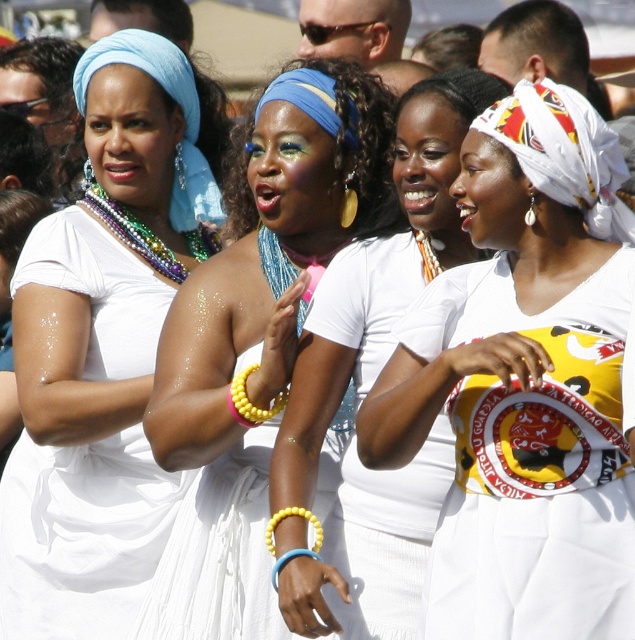
Question: Which of the following is the closest to the observer?

Choices:
 (A) (321, 97)
 (B) (239, 371)

Answer: (A)

Question: Does matte blue headscarf at center have a larger size compared to blue fabric headscarf at center?

Choices:
 (A) yes
 (B) no

Answer: (A)

Question: In this image, where is yellow beaded bracelet at center located relative to yellow beaded bracelet at lower center?

Choices:
 (A) above
 (B) below

Answer: (A)

Question: Among these points, which one is farthest from the camera?

Choices:
 (A) [x=244, y=145]
 (B) [x=269, y=548]
 (C) [x=72, y=390]
 (D) [x=272, y=81]

Answer: (D)

Question: Can you confirm if white fabric headscarf at center is thinner than yellow beaded bracelet at center?

Choices:
 (A) yes
 (B) no

Answer: (A)

Question: Which object is closer to the camera taking this photo?

Choices:
 (A) matte blue headscarf at center
 (B) white fabric headscarf at center
 (C) matte white dress at center

Answer: (B)